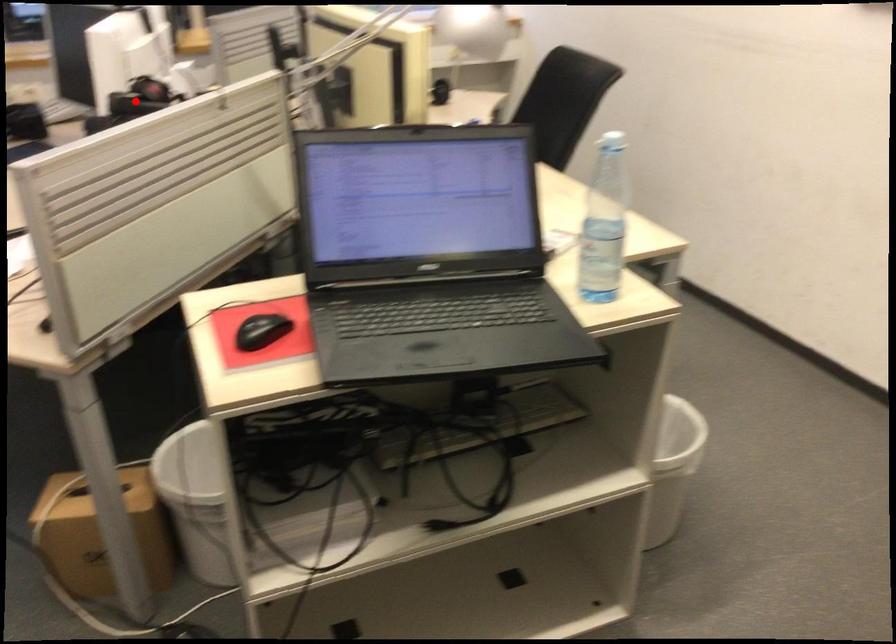
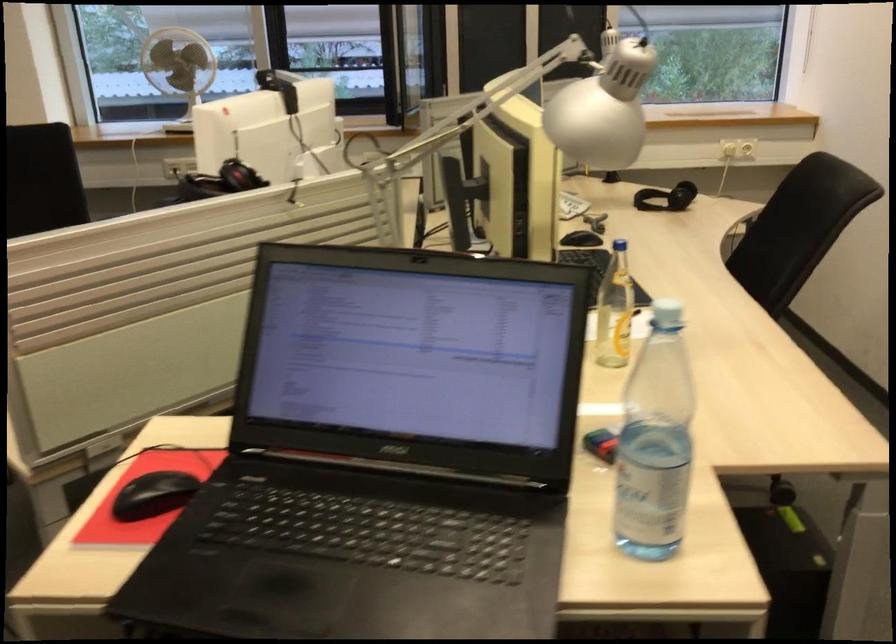
Question: A red point is marked in image1. In image2, is the corresponding 3D point closer to the camera or farther? Reply with the corresponding letter.

Choices:
 (A) The corresponding 3D point is closer.
 (B) The corresponding 3D point is farther.

Answer: (A)